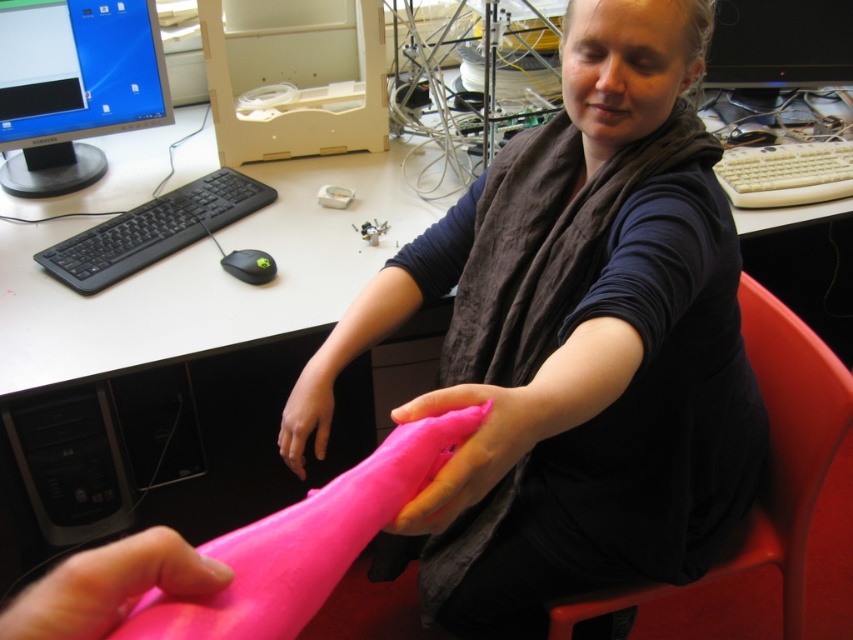
Does pink matte fabric at center come behind red plastic swivel chair at right?

No, it is not.

Who is taller, pink matte fabric at center or red plastic swivel chair at right?

pink matte fabric at center

Is point (531, 252) closer to camera compared to point (753, 531)?

Yes, it is.

What are the coordinates of `pink matte fabric at center` in the screenshot? It's located at (579, 342).

Is pink matte fabric at center above beige plastic keyboard at upper right?

No.

Between pink matte fabric at center and beige plastic keyboard at upper right, which one has less height?

Standing shorter between the two is beige plastic keyboard at upper right.

Does point (508, 252) come in front of point (784, 188)?

Yes, it is in front of point (784, 188).

I want to click on pink matte fabric at center, so click(579, 342).

Between point (148, 588) and point (796, 189), which one is positioned in front?

Point (148, 588) is more forward.

The width and height of the screenshot is (853, 640). Describe the element at coordinates (109, 586) in the screenshot. I see `pink rubber finger at center` at that location.

Locate an element on the screen. This screenshot has width=853, height=640. pink rubber finger at center is located at coordinates (109, 586).